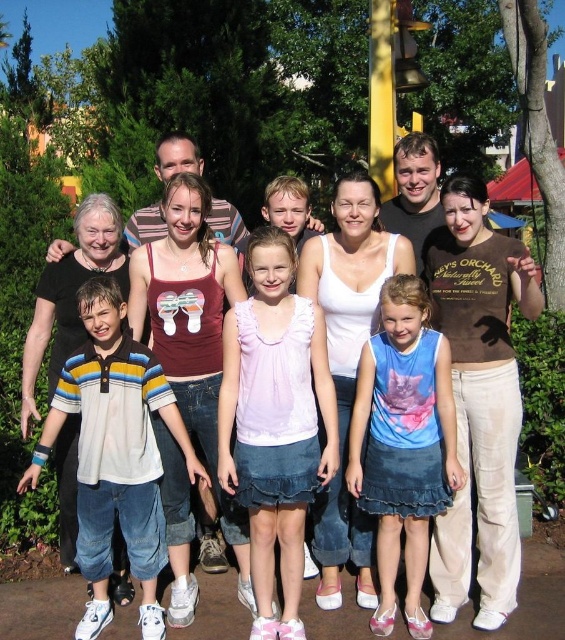
Question: Is striped cotton shirt at left to the left of white cotton tank top at center from the viewer's perspective?

Choices:
 (A) no
 (B) yes

Answer: (A)

Question: Which of the following is the farthest from the observer?

Choices:
 (A) (202, 467)
 (B) (359, 436)

Answer: (A)

Question: Which object appears closest to the camera in this image?

Choices:
 (A) blue denim skirt at center
 (B) pink satin blouse at center

Answer: (B)

Question: Does striped cotton shirt at left appear under blue denim skirt at center?

Choices:
 (A) yes
 (B) no

Answer: (A)

Question: Estimate the real-world distances between objects in this image. Which object is closer to the striped cotton shirt at left?

Choices:
 (A) blue denim skirt at center
 (B) pink satin blouse at center

Answer: (B)

Question: Can you confirm if white cotton tank top at center is wider than blue denim skirt at center?

Choices:
 (A) yes
 (B) no

Answer: (A)